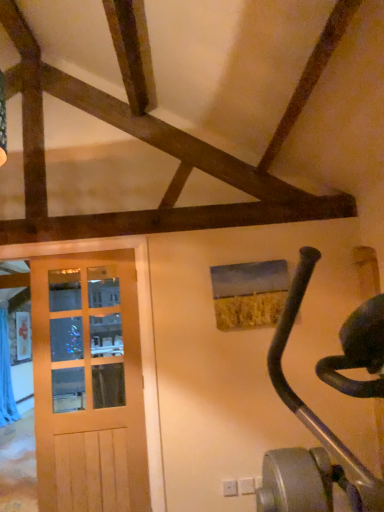
The width and height of the screenshot is (384, 512). What do you see at coordinates (6, 375) in the screenshot?
I see `blue fabric curtain at left` at bounding box center [6, 375].

Find the location of a particular element. blue fabric curtain at left is located at coordinates click(x=6, y=375).

Measure the distance between blue fabric curtain at left and camera.

blue fabric curtain at left and camera are 3.74 meters apart.

Measure the distance between point [8,376] and camera.

3.82 meters.

At what (x,y) coordinates should I click in order to perform the action: click on blue fabric curtain at left. Please return your answer as a coordinate pair (x, y). The height and width of the screenshot is (512, 384). Looking at the image, I should click on (6, 375).